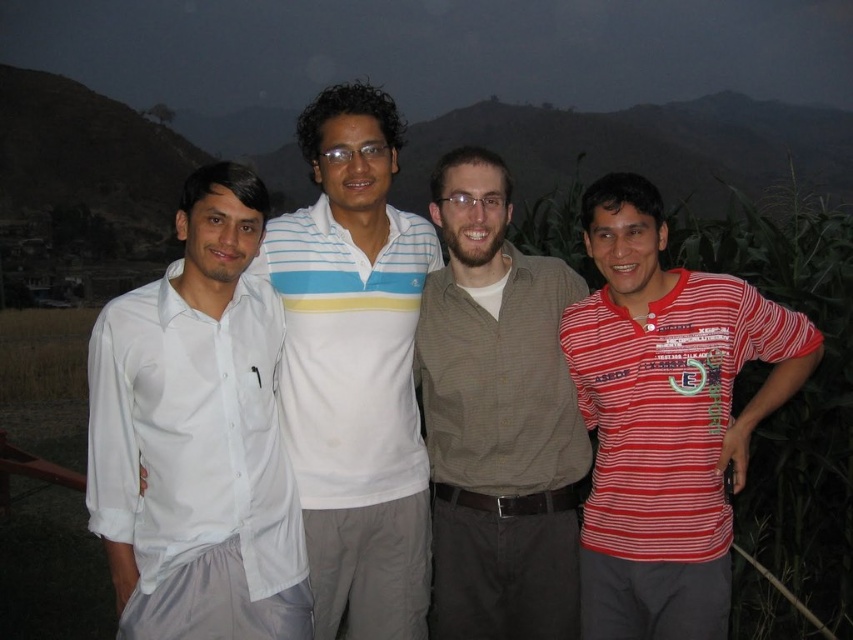
You are a photographer trying to capture a group photo of the red striped shirt at right and the brown textured shirt at center. Since you want both subjects to appear equally tall in the photo, which subject should you position closer to the camera?

To make the red striped shirt at right and the brown textured shirt at center appear equally tall in the photo, you should position the red striped shirt at right closer to the camera since it is shorter in real life.

You are a photographer trying to capture a clear shot of both the red striped shirt at right and the white striped polo shirt at center. Since you want both subjects in focus, you need to adjust your camera settings so that the depth of field includes both. Given their positions, which shirt should you focus on to ensure both are sharp?

You should focus on the red striped shirt at right because it is closer to the viewer than the white striped polo shirt at center. By focusing on the closer subject, the depth of field will extend backward, increasing the likelihood that both shirts are in focus.

You are standing at the point with coordinates point (x=300, y=376) and want to walk towards the point with coordinates point (x=668, y=358). Will you be moving towards the background or the foreground of the image?

Point (x=668, y=358) is in front of point (x=300, y=376). Therefore, moving from point (x=300, y=376) towards point (x=668, y=358) would mean moving towards the foreground of the image.